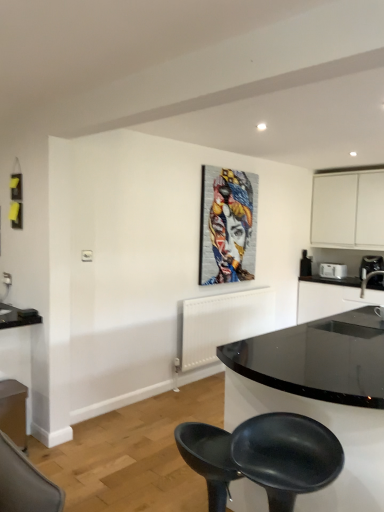
Question: Does black glossy sink at right have a greater width compared to black glossy countertop at right?

Choices:
 (A) no
 (B) yes

Answer: (A)

Question: From the image's perspective, is black glossy sink at right located beneath black glossy countertop at right?

Choices:
 (A) yes
 (B) no

Answer: (B)

Question: Does black glossy sink at right have a greater height compared to black glossy countertop at right?

Choices:
 (A) no
 (B) yes

Answer: (A)

Question: Would you say black glossy sink at right is outside black glossy countertop at right?

Choices:
 (A) yes
 (B) no

Answer: (A)

Question: Does black glossy sink at right have a smaller size compared to black glossy countertop at right?

Choices:
 (A) yes
 (B) no

Answer: (A)

Question: Is black glossy sink at right in front of or behind matte white cabinet at lower left, which is counted as the 2th cabinetry, starting from the right, in the image?

Choices:
 (A) behind
 (B) front

Answer: (B)

Question: Is point (360, 281) positioned closer to the camera than point (11, 392)?

Choices:
 (A) farther
 (B) closer

Answer: (A)

Question: Is black glossy sink at right spatially inside matte white cabinet at lower left, the 2th cabinetry when ordered from top to bottom, or outside of it?

Choices:
 (A) outside
 (B) inside

Answer: (A)

Question: From a real-world perspective, is black glossy sink at right above or below matte white cabinet at lower left, marked as the 2th cabinetry in a back-to-front arrangement?

Choices:
 (A) below
 (B) above

Answer: (B)

Question: Considering their positions, is metallic textured painting at center located in front of or behind black glossy sink at right?

Choices:
 (A) behind
 (B) front

Answer: (A)

Question: Considering the positions of metallic textured painting at center and black glossy sink at right in the image, is metallic textured painting at center bigger or smaller than black glossy sink at right?

Choices:
 (A) small
 (B) big

Answer: (B)

Question: From the image's perspective, is metallic textured painting at center positioned above or below black glossy sink at right?

Choices:
 (A) below
 (B) above

Answer: (B)

Question: Is metallic textured painting at center to the left or to the right of black glossy sink at right in the image?

Choices:
 (A) right
 (B) left

Answer: (B)

Question: From a real-world perspective, is matte white cabinet at lower left, the first cabinetry positioned from the left, above or below black glossy countertop at right?

Choices:
 (A) above
 (B) below

Answer: (B)

Question: Looking at the image, does matte white cabinet at lower left, which is the first cabinetry from bottom to top, seem bigger or smaller compared to black glossy countertop at right?

Choices:
 (A) big
 (B) small

Answer: (B)